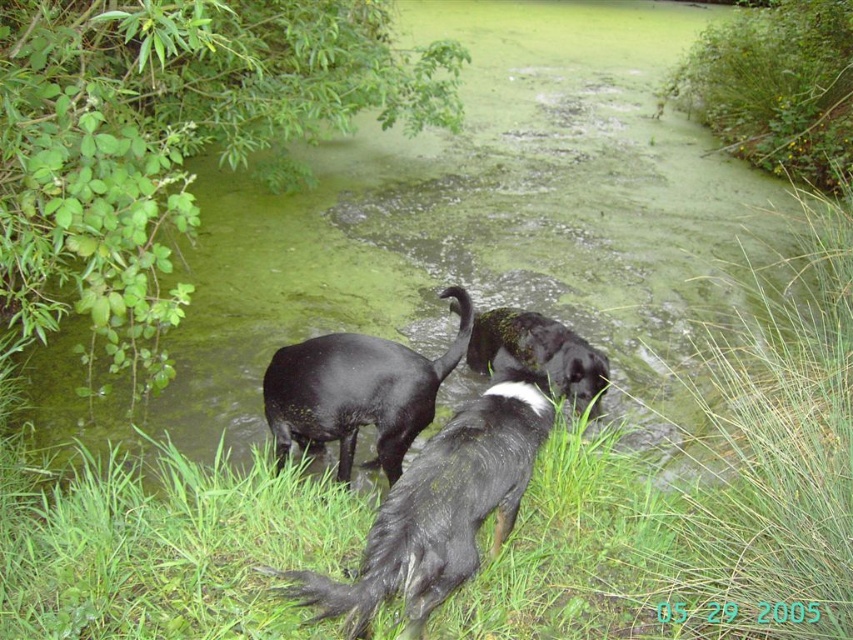
Where is the black matte dog at center located in the image?

The black matte dog at center is located at point (357, 392).

You are a photographer trying to capture a group photo of the black fur dog at center and the black matte dog at center. If your camera can only focus on objects within a 25 inch range, will both dogs be in focus?

The black fur dog at center and black matte dog at center are 29.24 inches apart from each other, which exceeds the camera focus range of 25 inches. Therefore, both dogs cannot be in focus simultaneously.

You are standing at the point marked as point (440, 508) and see the black fur dog at center. Which direction should you move to get closer to the black fur dog at center?

You are already at the location of the black fur dog at center, so no movement is needed.